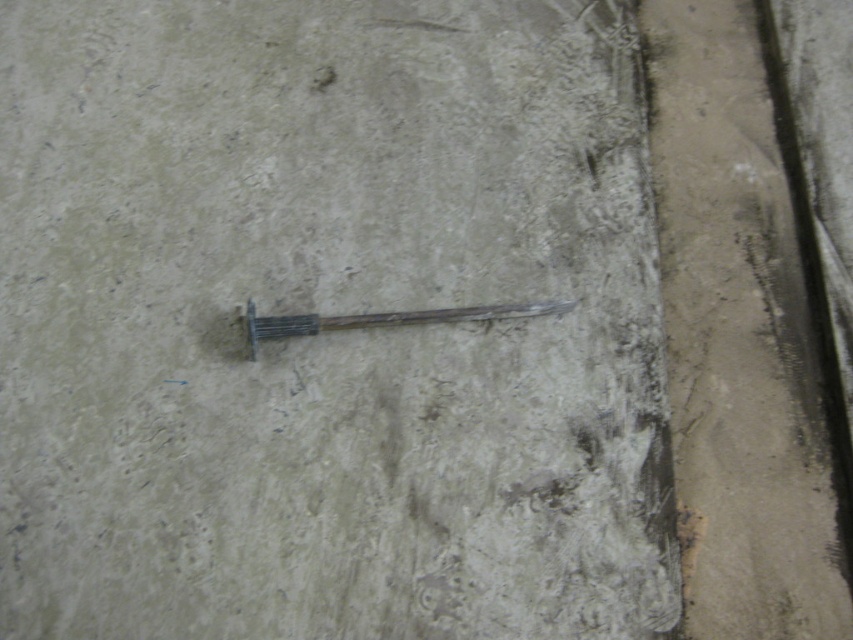
Consider the image. Which is above, smooth concrete at right or wooden stick at center?

smooth concrete at right is higher up.

Who is more forward, (753, 480) or (404, 323)?

Positioned in front is point (753, 480).

I want to click on smooth concrete at right, so click(x=730, y=340).